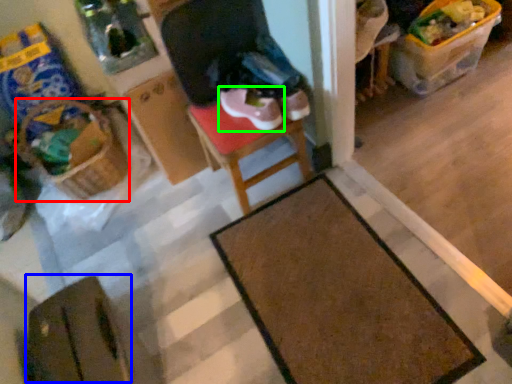
Question: Based on their relative distances, which object is nearer to basket (highlighted by a red box)? Choose from wide (highlighted by a blue box) and footwear (highlighted by a green box).

Choices:
 (A) wide
 (B) footwear

Answer: (B)